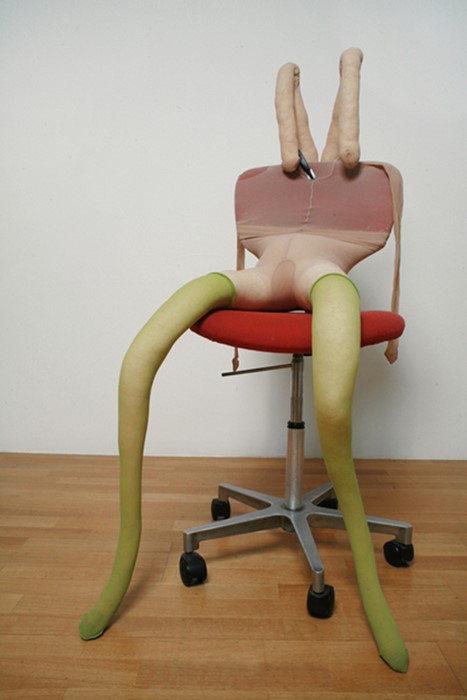
Locate an element on the screen. white wall is located at coordinates (55, 386).